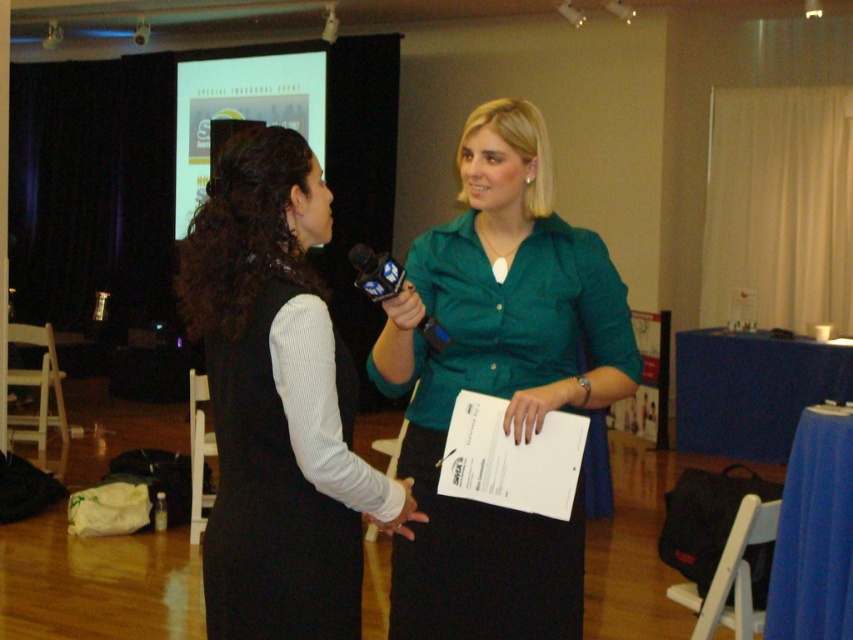
Question: Which of the following is the farthest from the observer?

Choices:
 (A) (387, 288)
 (B) (254, 464)
 (C) (537, 134)

Answer: (C)

Question: Among these points, which one is farthest from the camera?

Choices:
 (A) (224, 522)
 (B) (477, 346)
 (C) (316, 584)

Answer: (B)

Question: Which object is closer to the camera taking this photo?

Choices:
 (A) black matte dress at center
 (B) green matte shirt at center
 (C) black plastic microphone at center

Answer: (A)

Question: Observing the image, what is the correct spatial positioning of green matte shirt at center in reference to black plastic microphone at center?

Choices:
 (A) right
 (B) left

Answer: (A)

Question: Is black matte dress at center below black plastic microphone at center?

Choices:
 (A) yes
 (B) no

Answer: (A)

Question: Can you confirm if black matte dress at center is positioned to the right of black ribbed fabric dress at center?

Choices:
 (A) yes
 (B) no

Answer: (A)